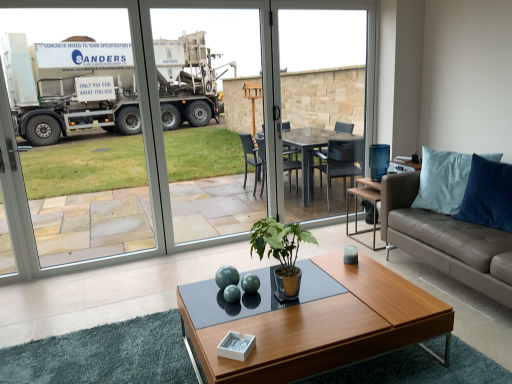
Question: Based on their positions, is transparent glass screen door at center located to the left or right of leather couch at right?

Choices:
 (A) right
 (B) left

Answer: (B)

Question: Does point (147, 148) appear closer or farther from the camera than point (446, 216)?

Choices:
 (A) closer
 (B) farther

Answer: (B)

Question: Which of these objects is positioned farthest from the transparent glass screen door at center?

Choices:
 (A) leather couch at right
 (B) blue suede pillow at right
 (C) transparent glass table at center
 (D) green glossy plant at center
 (E) wooden coffee table at center

Answer: (C)

Question: Which is nearer to the blue suede pillow at right?

Choices:
 (A) leather couch at right
 (B) wooden coffee table at center
 (C) green glossy plant at center
 (D) transparent glass table at center
 (E) transparent glass screen door at center

Answer: (A)